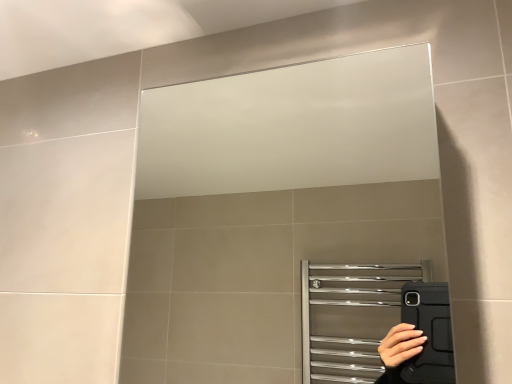
Locate an element on the screen. Image resolution: width=512 pixels, height=384 pixels. matte glass mirror at upper center is located at coordinates (271, 207).

The height and width of the screenshot is (384, 512). What do you see at coordinates (271, 207) in the screenshot? I see `matte glass mirror at upper center` at bounding box center [271, 207].

Image resolution: width=512 pixels, height=384 pixels. I want to click on matte glass mirror at upper center, so click(x=271, y=207).